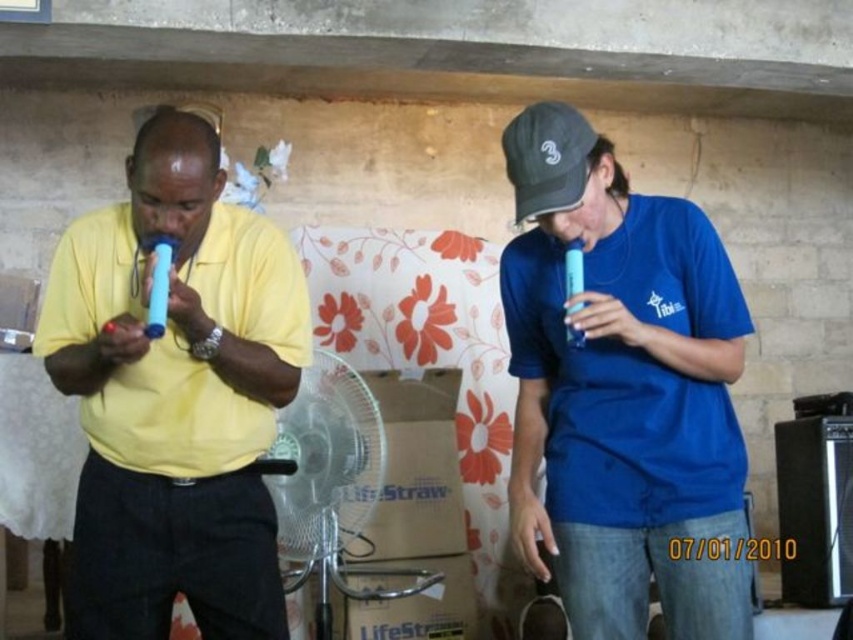
You are a photographer setting up a shoot in this scene. You need to position a spotlight so it illuminates both the matte yellow shirt at left and the black fabric baseball cap at upper right without casting shadows over other objects. Given their height difference, which object should the spotlight be angled downward towards?

The spotlight should be angled downward towards the matte yellow shirt at left because it has a greater height compared to the black fabric baseball cap at upper right, ensuring both are illuminated without casting shadows on other objects.

You are setting up a booth for a product demonstration. You need to place a sign that must be visible to both attendees on the left and right sides of the booth. The sign will be placed on a stand that can only hold items narrower than the clear plastic fan at center. Will the sign fit if it is as wide as the black fabric baseball cap at upper right?

The clear plastic fan at center might be wider than the black fabric baseball cap at upper right. Since the sign is as wide as the black fabric baseball cap at upper right, it will definitely be narrower than the fan, so the sign will fit on the stand.